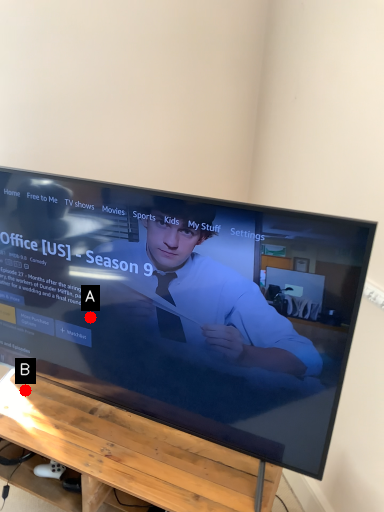
Question: Two points are circled on the image, labeled by A and B beside each circle. Which point appears closest to the camera in this image?

Choices:
 (A) A is closer
 (B) B is closer

Answer: (A)